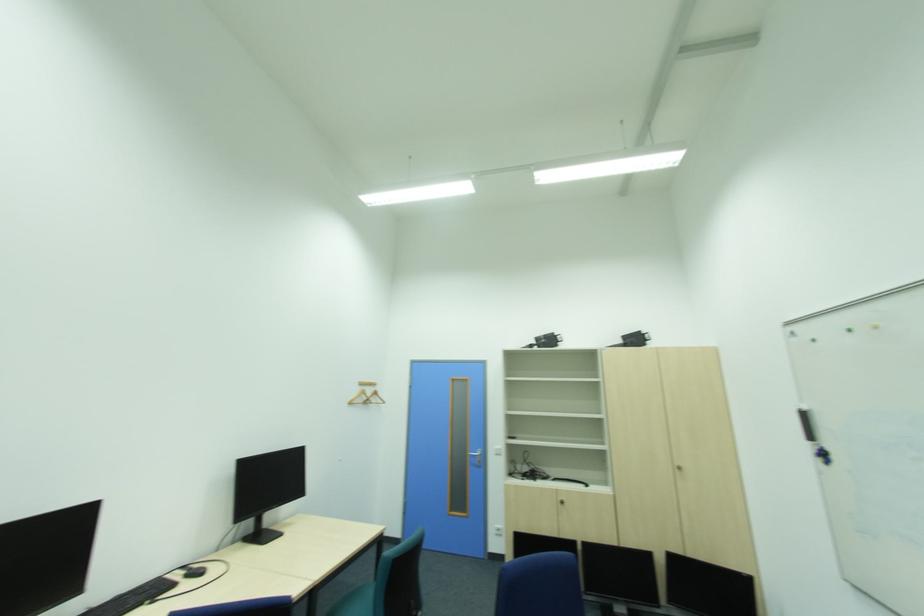
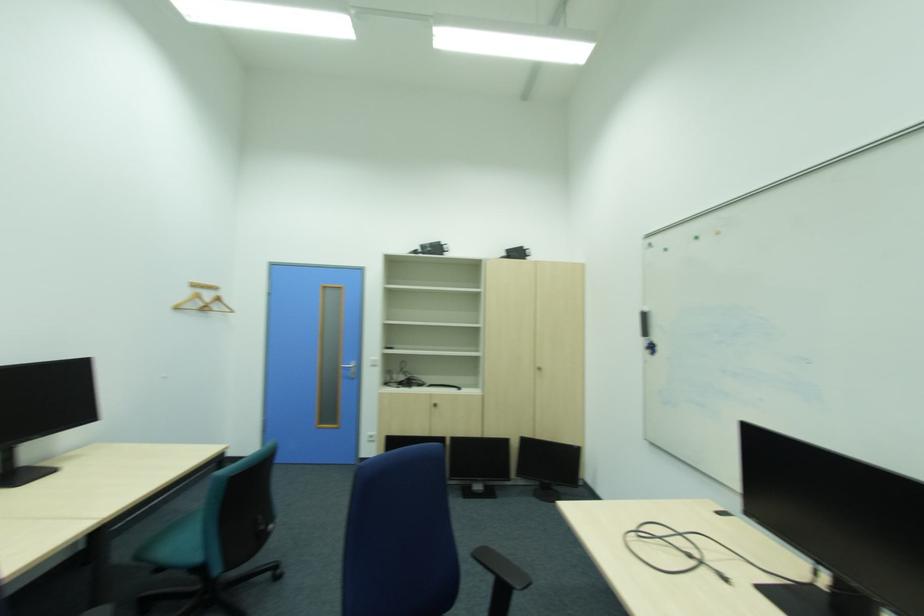
In the second image, find the point that corresponds to point (367, 390) in the first image.

(199, 292)